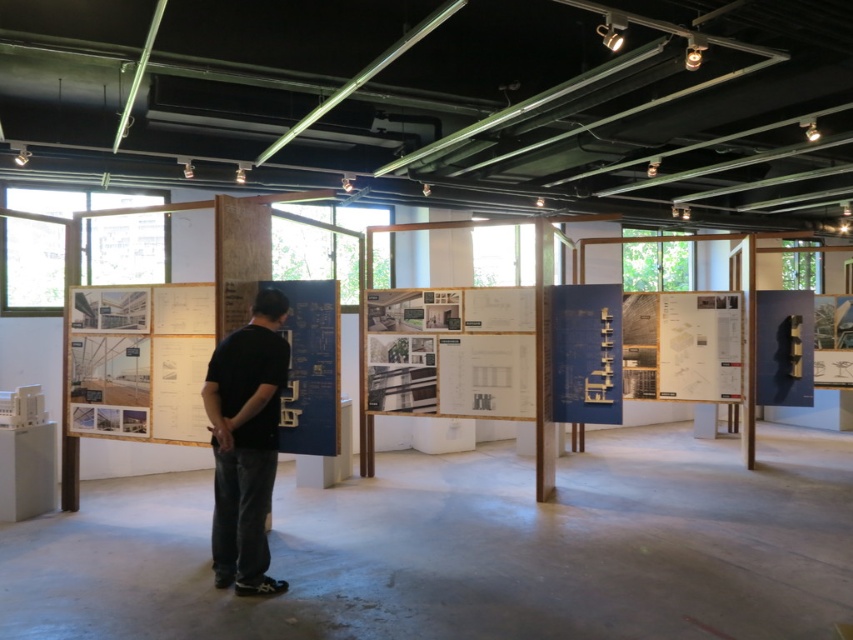
Measure the distance between white paper at center and matte paper poster at right.

The distance of white paper at center from matte paper poster at right is 13.01 feet.

Identify the location of white paper at center. The height and width of the screenshot is (640, 853). (486, 376).

Is point (672, 369) closer to viewer compared to point (817, 307)?

Yes, it is.

Is matte paper poster at center thinner than matte paper poster at right?

No, matte paper poster at center is not thinner than matte paper poster at right.

Image resolution: width=853 pixels, height=640 pixels. Find the location of `matte paper poster at center`. matte paper poster at center is located at coordinates (699, 346).

Image resolution: width=853 pixels, height=640 pixels. What do you see at coordinates (245, 444) in the screenshot?
I see `black cotton shirt at center` at bounding box center [245, 444].

Can you confirm if black cotton shirt at center is bigger than white paper at center?

Yes.

Is point (276, 355) behind point (479, 381)?

No, it is in front of (479, 381).

This screenshot has height=640, width=853. I want to click on black cotton shirt at center, so click(x=245, y=444).